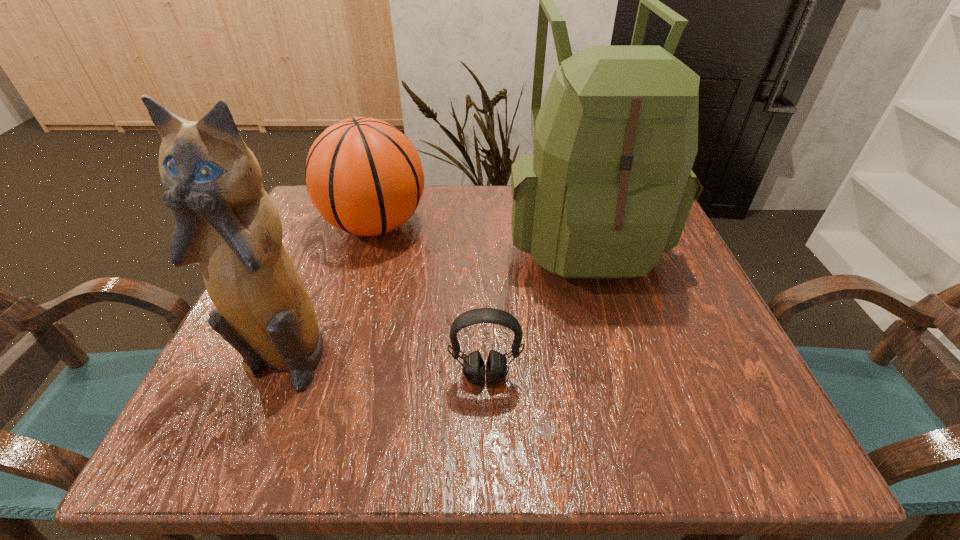
Identify the location of backpack. (608, 189).

The image size is (960, 540). I want to click on cat, so click(226, 223).

This screenshot has height=540, width=960. I want to click on basketball, so click(364, 176).

Identify the location of headset. (473, 367).

At what (x,y) coordinates should I click in order to perform the action: click on free point located 0.270m on the front pocket of the backpack. Please return your answer as a coordinate pair (x, y). Image resolution: width=960 pixels, height=540 pixels. Looking at the image, I should click on (636, 426).

Identify the location of vacant area situated on the face of the cat. (256, 422).

What are the coordinates of `blank area located 0.330m on the front of the basketball` in the screenshot? It's located at (324, 391).

I want to click on free space located 0.050m on the front-facing side of the shortest object, so click(x=486, y=416).

At what (x,y) coordinates should I click in order to perform the action: click on backpack present at the far edge. Please return your answer as a coordinate pair (x, y). Looking at the image, I should click on (608, 189).

Identify the location of basketball that is at the far edge. The width and height of the screenshot is (960, 540). (364, 176).